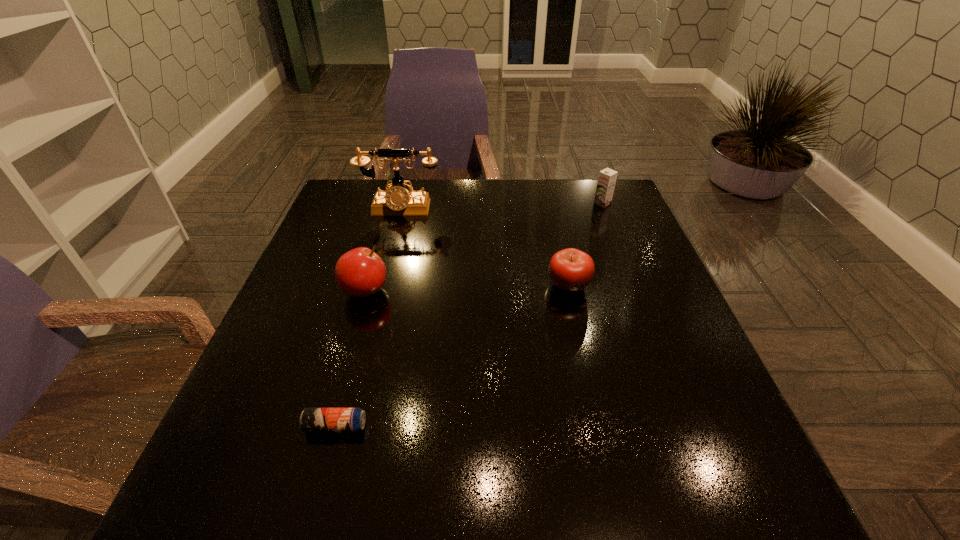
Identify the location of free region at the near edge. The height and width of the screenshot is (540, 960). (631, 497).

The width and height of the screenshot is (960, 540). I want to click on vacant point at the left edge, so click(262, 369).

At what (x,y) coordinates should I click in order to perform the action: click on free space at the right edge of the desktop. Please return your answer as a coordinate pair (x, y). Image resolution: width=960 pixels, height=540 pixels. Looking at the image, I should click on (615, 294).

Where is `vacant space at the far left corner`? This screenshot has height=540, width=960. vacant space at the far left corner is located at coordinates (358, 204).

Identify the location of vacant space at the near left corner. The width and height of the screenshot is (960, 540). (286, 474).

This screenshot has width=960, height=540. In the image, there is a desktop. In order to click on vacant region at the far right corner in this screenshot , I will do `click(592, 204)`.

At what (x,y) coordinates should I click in order to perform the action: click on vacant space that's between the chocolate milk and the right apple. Please return your answer as a coordinate pair (x, y). Looking at the image, I should click on (586, 244).

At what (x,y) coordinates should I click in order to perform the action: click on free area in between the tallest object and the rightmost object. Please return your answer as a coordinate pair (x, y). Looking at the image, I should click on (501, 206).

This screenshot has height=540, width=960. Identify the location of free point between the right apple and the beer can. (452, 355).

Locate an element on the screen. The width and height of the screenshot is (960, 540). free space between the left apple and the chocolate milk is located at coordinates (484, 247).